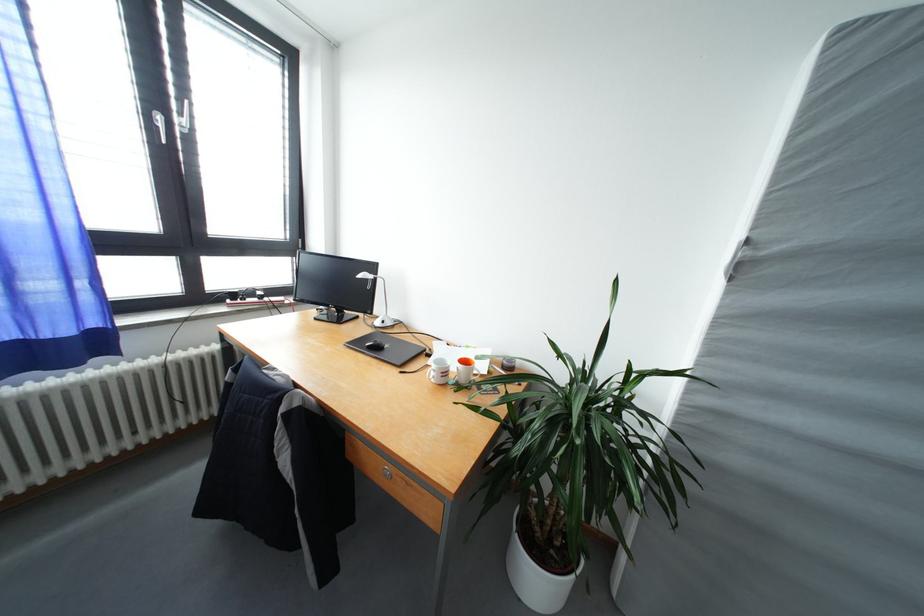
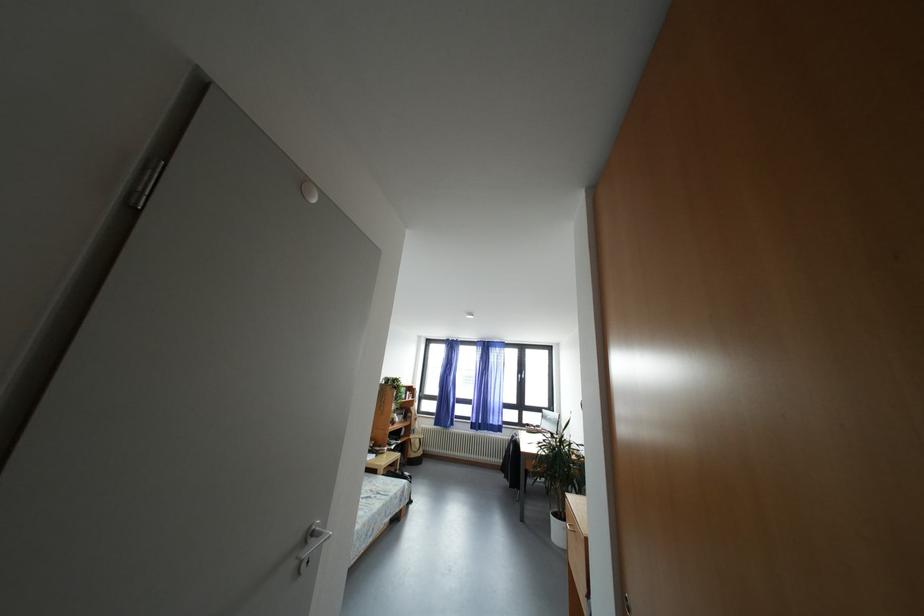
Find the pixel in the second image that matches point 239,301 in the first image.

(533, 430)